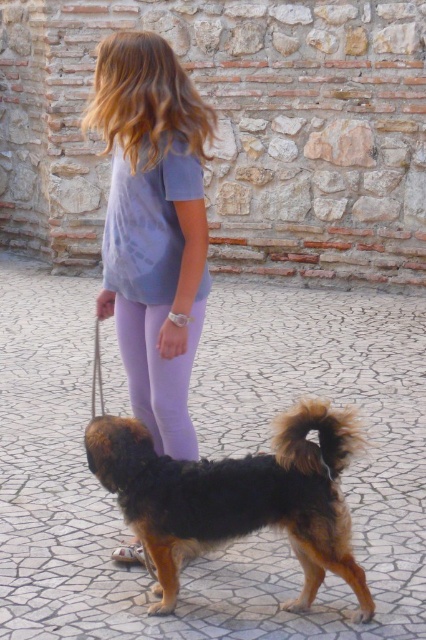
Who is lower down, purple cotton shirt at upper center or brown fur dog at lower center?

brown fur dog at lower center is lower down.

Which of these two, purple cotton shirt at upper center or brown fur dog at lower center, stands taller?

With more height is purple cotton shirt at upper center.

Which is in front, point (160, 426) or point (195, 525)?

Point (195, 525)

Image resolution: width=426 pixels, height=640 pixels. Find the location of `purple cotton shirt at upper center`. purple cotton shirt at upper center is located at coordinates (154, 225).

Can you confirm if brown fur dog at lower center is shorter than purple leggings at center?

Incorrect, brown fur dog at lower center's height does not fall short of purple leggings at center's.

From the picture: Between brown fur dog at lower center and purple leggings at center, which one has less height?

With less height is purple leggings at center.

Who is more distant from viewer, (146, 467) or (195, 435)?

Positioned behind is point (195, 435).

What are the coordinates of `brown fur dog at lower center` in the screenshot? It's located at pyautogui.click(x=236, y=497).

Does purple cotton shirt at upper center appear on the left side of purple leggings at center?

Correct, you'll find purple cotton shirt at upper center to the left of purple leggings at center.

Can you confirm if purple cotton shirt at upper center is bigger than purple leggings at center?

Yes.

Locate an element on the screen. purple cotton shirt at upper center is located at coordinates (154, 225).

This screenshot has width=426, height=640. What are the coordinates of `purple cotton shirt at upper center` in the screenshot? It's located at (154, 225).